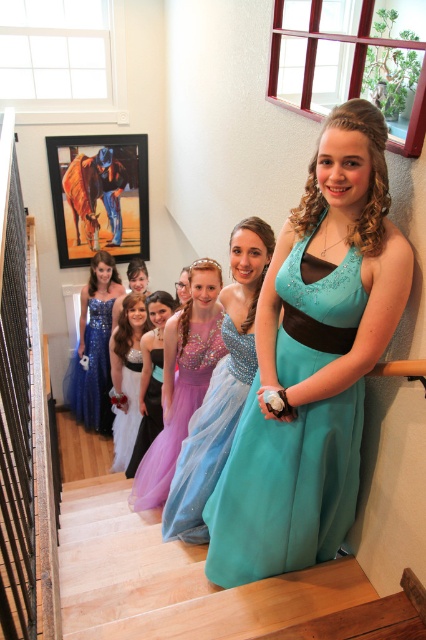
Question: Does sparkly teal dress at center appear on the right side of white satin dress at center?

Choices:
 (A) yes
 (B) no

Answer: (A)

Question: Is sparkly teal dress at center further to the viewer compared to purple tulle dress at center?

Choices:
 (A) no
 (B) yes

Answer: (A)

Question: Which point is closer to the camera taking this photo?

Choices:
 (A) (201, 403)
 (B) (138, 284)
 (C) (92, 342)

Answer: (A)

Question: Which object is closer to the camera taking this photo?

Choices:
 (A) shiny blue dress at left
 (B) purple tulle dress at center
 (C) matte purple dress at center

Answer: (B)

Question: Among these objects, which one is farthest from the camera?

Choices:
 (A) purple tulle dress at center
 (B) purple sequined dress at center
 (C) sparkly teal dress at center

Answer: (B)

Question: Where is white satin dress at center located in relation to purple sequined dress at center in the image?

Choices:
 (A) below
 (B) above

Answer: (A)